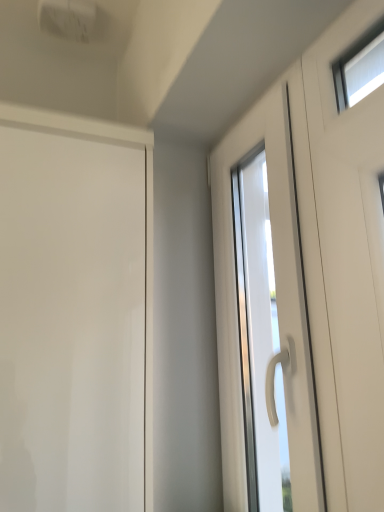
Question: Is white glossy door at center, which is the 2th door from left to right, located within glossy white door at left, which ranks as the first door in left-to-right order?

Choices:
 (A) no
 (B) yes

Answer: (A)

Question: Considering the relative sizes of glossy white door at left, the 2th door from the right, and white glossy door at center, the 1th door viewed from the right, in the image provided, is glossy white door at left, the 2th door from the right, thinner than white glossy door at center, the 1th door viewed from the right,?

Choices:
 (A) no
 (B) yes

Answer: (A)

Question: From the image's perspective, is glossy white door at left, the 2th door from the right, located beneath white glossy door at center, the 1th door viewed from the right?

Choices:
 (A) yes
 (B) no

Answer: (A)

Question: Does glossy white door at left, which ranks as the first door in left-to-right order, lie in front of white glossy door at center, the 1th door viewed from the right?

Choices:
 (A) yes
 (B) no

Answer: (A)

Question: Is the depth of glossy white door at left, the 2th door from the right, greater than that of white glossy door at center, the 1th door viewed from the right?

Choices:
 (A) yes
 (B) no

Answer: (B)

Question: Is glossy white door at left, which ranks as the first door in left-to-right order, not within white glossy door at center, which is the 2th door from left to right?

Choices:
 (A) no
 (B) yes

Answer: (B)

Question: Can you confirm if white glossy door at center, the 1th door viewed from the right, is thinner than glossy white door at left, which ranks as the first door in left-to-right order?

Choices:
 (A) no
 (B) yes

Answer: (B)

Question: Does white glossy door at center, the 1th door viewed from the right, lie behind glossy white door at left, the 2th door from the right?

Choices:
 (A) yes
 (B) no

Answer: (A)

Question: Is white glossy door at center, which is the 2th door from left to right, turned away from glossy white door at left, the 2th door from the right?

Choices:
 (A) yes
 (B) no

Answer: (B)

Question: Is white glossy door at center, which is the 2th door from left to right, at the right side of glossy white door at left, the 2th door from the right?

Choices:
 (A) no
 (B) yes

Answer: (B)

Question: Considering the relative sizes of white glossy door at center, the 1th door viewed from the right, and glossy white door at left, which ranks as the first door in left-to-right order, in the image provided, is white glossy door at center, the 1th door viewed from the right, shorter than glossy white door at left, which ranks as the first door in left-to-right order,?

Choices:
 (A) no
 (B) yes

Answer: (A)

Question: Can you see white glossy door at center, which is the 2th door from left to right, touching glossy white door at left, which ranks as the first door in left-to-right order?

Choices:
 (A) yes
 (B) no

Answer: (B)

Question: Which is correct: glossy white door at left, which ranks as the first door in left-to-right order, is inside white glossy door at center, which is the 2th door from left to right, or outside of it?

Choices:
 (A) outside
 (B) inside

Answer: (A)